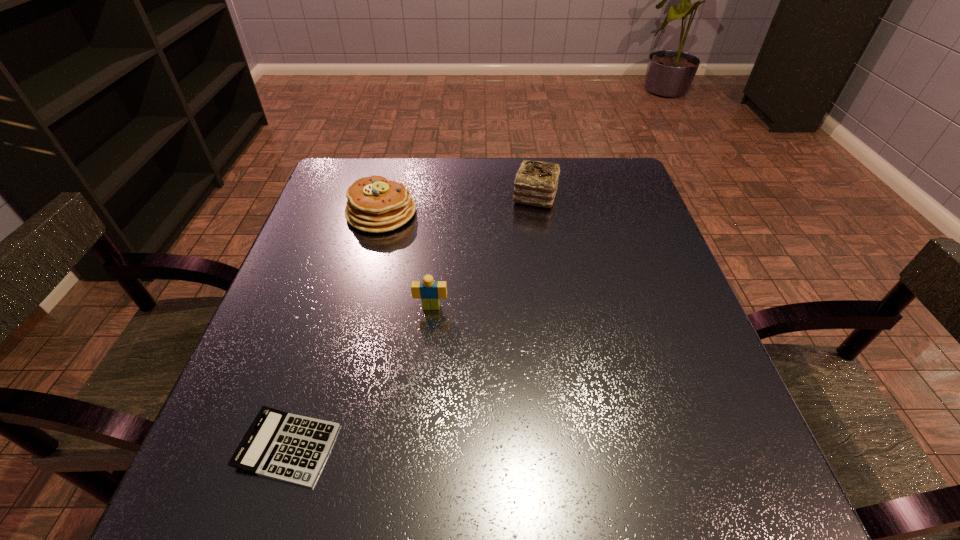
This screenshot has height=540, width=960. I want to click on vacant space that is in between the shortest object and the rightmost object, so click(412, 322).

Where is `free space between the shortest object and the pancake`? free space between the shortest object and the pancake is located at coordinates (334, 330).

The height and width of the screenshot is (540, 960). In order to click on vacant area that lies between the rightmost object and the pancake in this screenshot , I will do `click(459, 205)`.

The image size is (960, 540). I want to click on vacant space that's between the chocolate cake and the shortest object, so click(x=412, y=322).

Identify the location of free space that is in between the nearest object and the pancake. (334, 330).

Identify which object is located as the nearest to the pancake. Please provide its 2D coordinates. Your answer should be formatted as a tuple, i.e. [(x, y)], where the tuple contains the x and y coordinates of a point satisfying the conditions above.

[(429, 291)]

Locate an element on the screen. This screenshot has width=960, height=540. the third closest object relative to the nearest object is located at coordinates (536, 182).